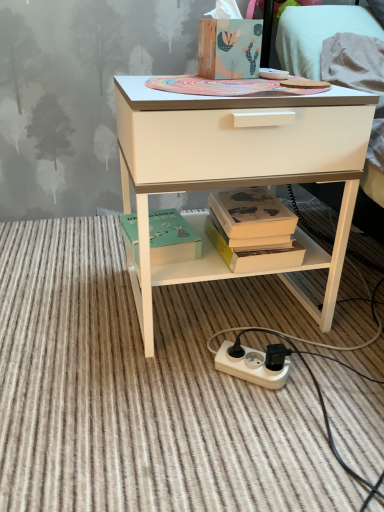
This screenshot has width=384, height=512. I want to click on vacant region in front of white matte desk at center, so click(x=206, y=419).